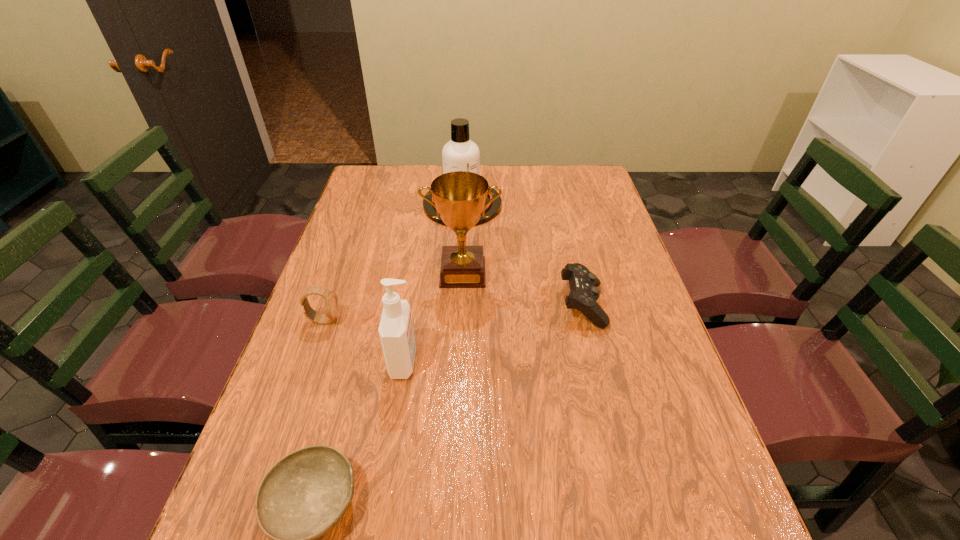
Locate an element on the screen. blank area located on the face of the fourth tallest object is located at coordinates (463, 320).

Where is `free space located 0.230m on the front of the second shortest object`? free space located 0.230m on the front of the second shortest object is located at coordinates (609, 413).

Identify the location of object that is at the far edge. (x=459, y=154).

What are the coordinates of `object that is at the left edge` in the screenshot? It's located at (331, 301).

The width and height of the screenshot is (960, 540). In order to click on object present at the right edge in this screenshot , I will do `click(584, 293)`.

Image resolution: width=960 pixels, height=540 pixels. In order to click on vacant space at the far edge of the desktop in this screenshot , I will do coord(528,178).

Where is `free space at the left edge of the desktop`? The height and width of the screenshot is (540, 960). free space at the left edge of the desktop is located at coordinates (302, 375).

Locate an element on the screen. free space at the right edge is located at coordinates (601, 301).

In the image, there is a desktop. Identify the location of vacant space at the far left corner. (382, 179).

Where is `free space at the far right corner of the desktop`? The height and width of the screenshot is (540, 960). free space at the far right corner of the desktop is located at coordinates (596, 186).